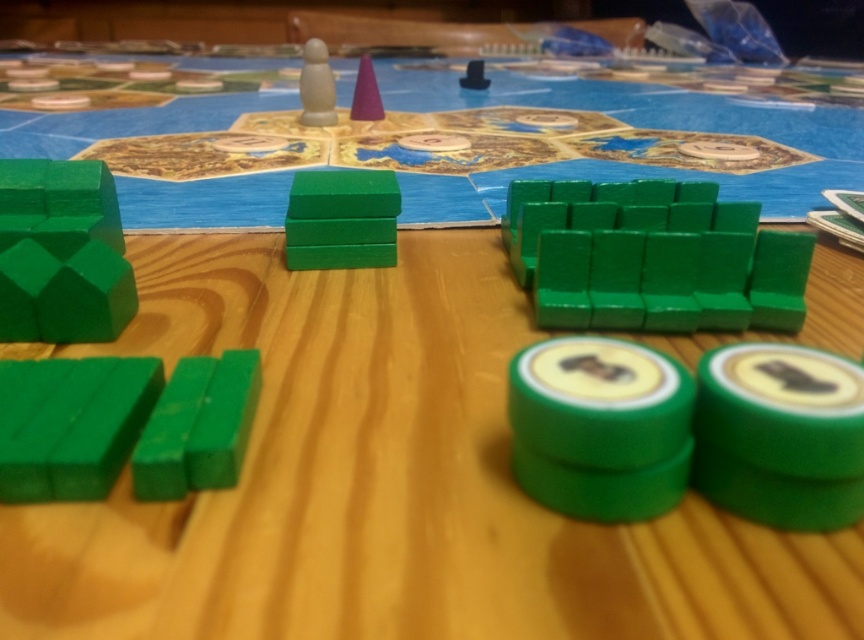
Question: Can you confirm if purple matte cone at center is positioned below black plastic cube at upper center?

Choices:
 (A) yes
 (B) no

Answer: (A)

Question: Which point is closer to the camera?

Choices:
 (A) (607, 369)
 (B) (353, 113)

Answer: (A)

Question: Is green matte blocks at center right behind green matte cube at left?

Choices:
 (A) yes
 (B) no

Answer: (A)

Question: Can you confirm if green matte cube at left is wider than matte green block at center?

Choices:
 (A) no
 (B) yes

Answer: (B)

Question: Which object is positioned farthest from the matte plastic pawn at upper center?

Choices:
 (A) green matte token at lower right
 (B) green matte rectangular block at lower left
 (C) green matte cube at left
 (D) green matte token at center

Answer: (A)

Question: Which of the following is the farthest from the observer?

Choices:
 (A) (373, 81)
 (B) (467, 65)

Answer: (B)